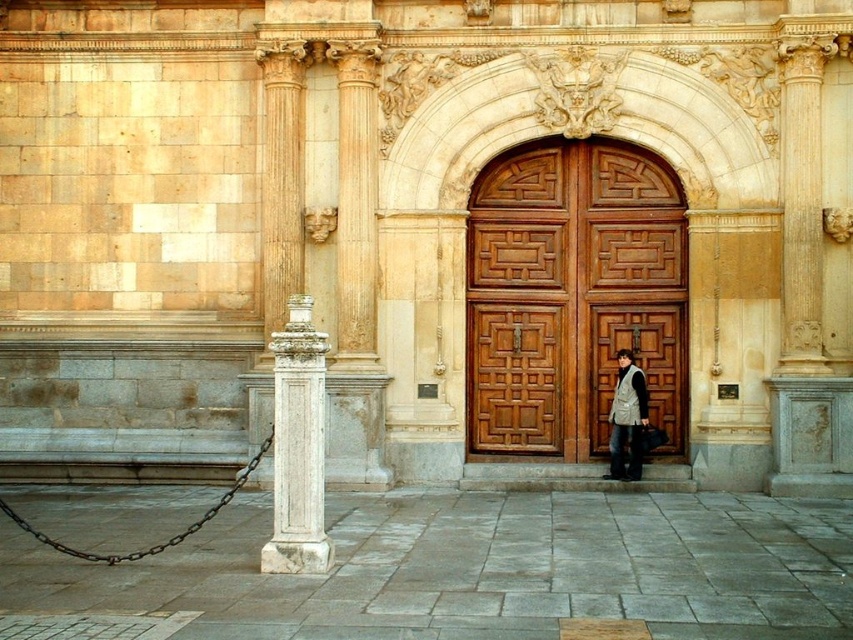
Can you confirm if wooden at center is wider than white marble pillar at left?

No, wooden at center is not wider than white marble pillar at left.

Is wooden at center shorter than white marble pillar at left?

Yes, wooden at center is shorter than white marble pillar at left.

Does point (599, 358) come behind point (318, 336)?

Yes, point (599, 358) is farther from viewer.

What are the coordinates of `wooden at center` in the screenshot? It's located at (572, 296).

Is wooden at center positioned in front of light gray textured vest at center?

No, it is behind light gray textured vest at center.

Between point (633, 288) and point (624, 381), which one is positioned in front?

Point (624, 381) is in front.

Between point (585, 340) and point (621, 371), which one is positioned in front?

Point (621, 371) is in front.

Where is `wooden at center`? This screenshot has height=640, width=853. wooden at center is located at coordinates (572, 296).

Is white marble pillar at left below light gray textured vest at center?

Yes.

Does white marble pillar at left have a smaller size compared to light gray textured vest at center?

Indeed, white marble pillar at left has a smaller size compared to light gray textured vest at center.

What do you see at coordinates (299, 445) in the screenshot?
I see `white marble pillar at left` at bounding box center [299, 445].

In order to click on white marble pillar at left in this screenshot , I will do `click(299, 445)`.